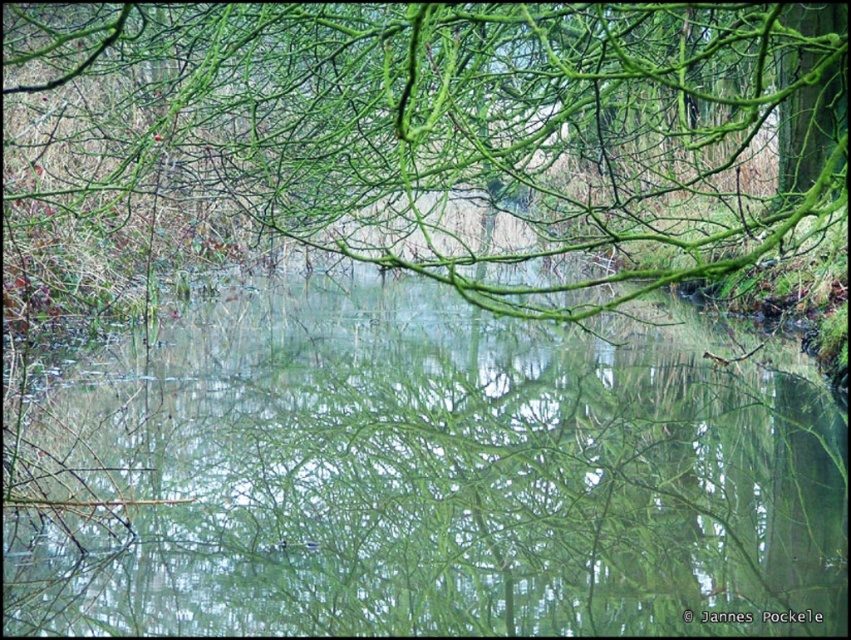
You are standing at the edge of the water and want to place a small floating decoration. Given the positions of the green reflective water at center and the green matte branches at upper center, where should you place the decoration to ensure it stays visible and not hidden by the branches?

You should place the decoration on the green reflective water at center below the green matte branches at upper center because the water is positioned under the branches, allowing the decoration to remain visible without being obscured.

You are an artist trying to paint this scene. You need to decide which area to focus on first based on their widths. According to the scene, which object has a narrower width? Please choose between the green reflective water at center and the green matte branches at upper center.

The green reflective water at center has a narrower width compared to the green matte branches at upper center.